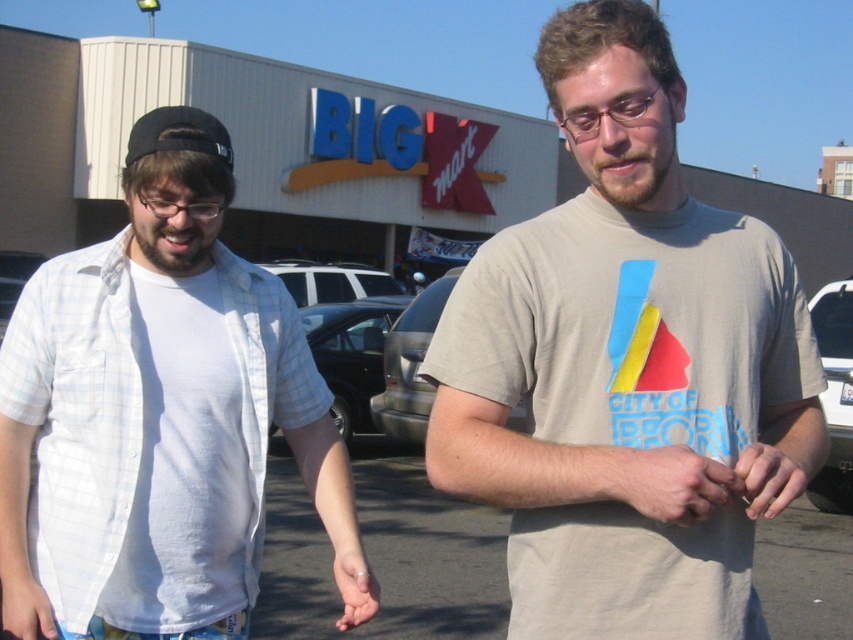
Question: Which object is the farthest from the white matte hand at lower left?

Choices:
 (A) smooth skin hand at lower center
 (B) white cotton shirt at left
 (C) light beige t-shirt at center

Answer: (C)

Question: Which object is closer to the camera taking this photo?

Choices:
 (A) light beige t-shirt at center
 (B) smooth beige shirt at center

Answer: (B)

Question: Where is smooth beige shirt at center located in relation to smooth skin hand at center in the image?

Choices:
 (A) below
 (B) above

Answer: (A)

Question: Estimate the real-world distances between objects in this image. Which object is closer to the smooth skin hand at lower center?

Choices:
 (A) smooth skin hand at center
 (B) light beige t-shirt at center
 (C) white matte hand at lower left

Answer: (C)

Question: Is white cotton shirt at left in front of smooth skin hand at lower center?

Choices:
 (A) yes
 (B) no

Answer: (A)

Question: Is white cotton shirt at left smaller than smooth beige shirt at center?

Choices:
 (A) yes
 (B) no

Answer: (B)